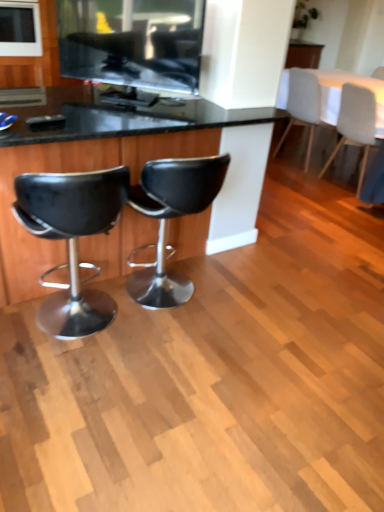
This screenshot has height=512, width=384. I want to click on vacant region in front of black leather desk at center, so click(134, 407).